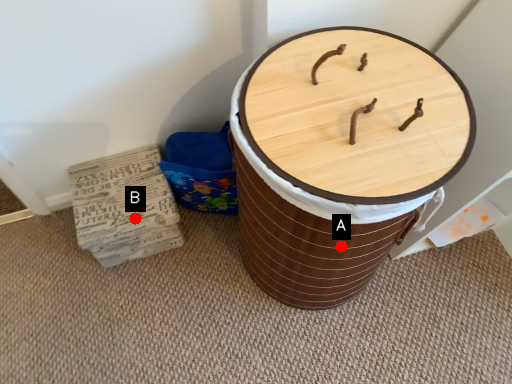
Question: Two points are circled on the image, labeled by A and B beside each circle. Which point appears closest to the camera in this image?

Choices:
 (A) A is closer
 (B) B is closer

Answer: (A)